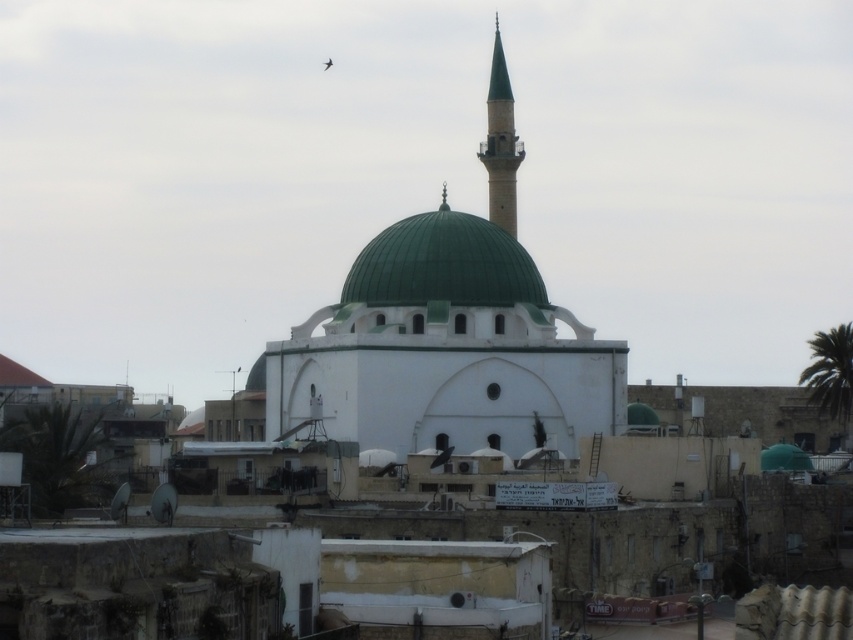
Locate an element on the screen. The height and width of the screenshot is (640, 853). green matte dome at center is located at coordinates [444, 264].

Is green matte dome at center to the left of green glazed minaret at upper center from the viewer's perspective?

Indeed, green matte dome at center is positioned on the left side of green glazed minaret at upper center.

Does point (469, 269) come farther from viewer compared to point (502, 188)?

No, it is in front of (502, 188).

Where is `green matte dome at center`? green matte dome at center is located at coordinates (444, 264).